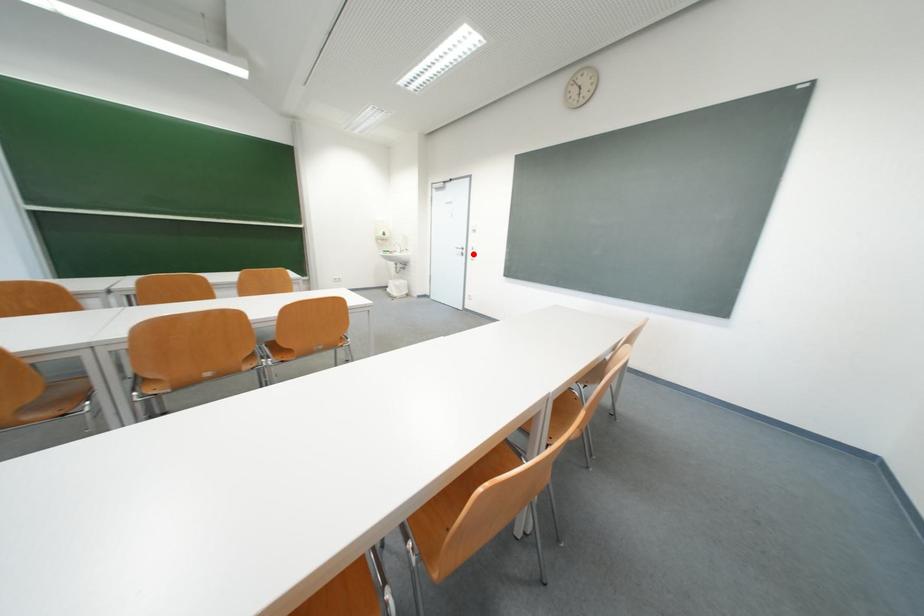
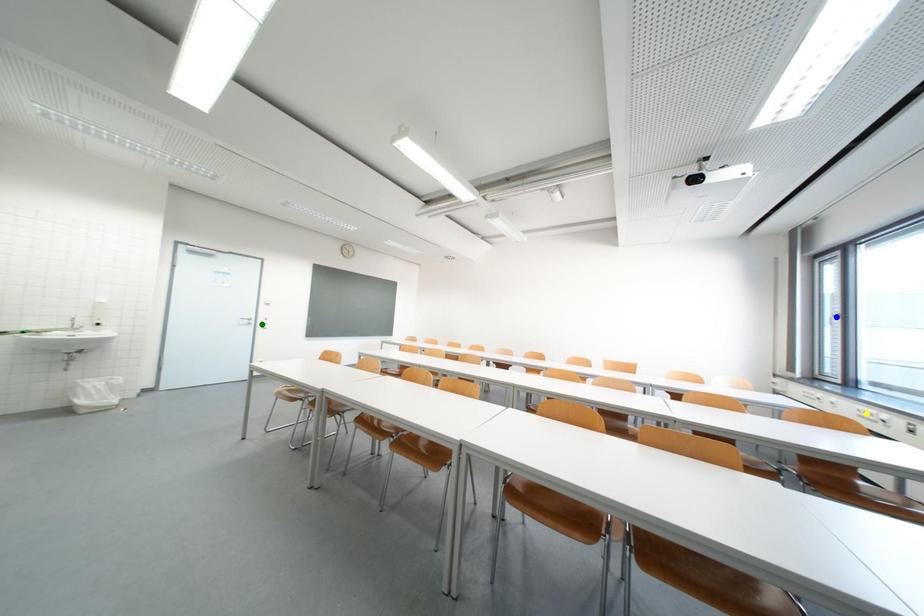
Question: I am providing you with two images of the same scene from different viewpoints. A red point is marked on the first image. You are given multiple points on the second image. Which point in image 2 is actually the same real-world point as the red point in image 1?

Choices:
 (A) green point
 (B) yellow point
 (C) blue point

Answer: (A)